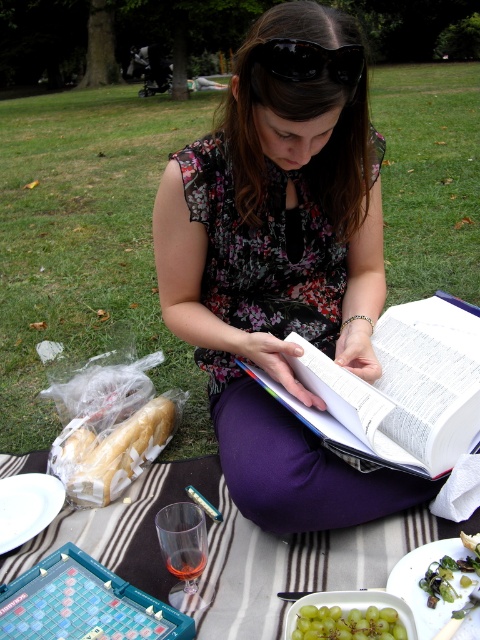
Question: Which of the following is the closest to the observer?

Choices:
 (A) green matte salad at lower right
 (B) green translucent grapes at lower center
 (C) black plastic goggles at center

Answer: (B)

Question: Estimate the real-world distances between objects in this image. Which object is farther from the white paper book at center?

Choices:
 (A) black plastic goggles at center
 (B) green matte salad at lower right

Answer: (A)

Question: Does white paper book at center have a lesser width compared to green matte salad at lower right?

Choices:
 (A) no
 (B) yes

Answer: (A)

Question: Can you confirm if white paper book at center is positioned above green matte salad at lower right?

Choices:
 (A) no
 (B) yes

Answer: (B)

Question: Which object is closer to the camera taking this photo?

Choices:
 (A) green grass at lower left
 (B) green leafy vegetables at lower right
 (C) green matte salad at lower right
 (D) green translucent grapes at lower center

Answer: (D)

Question: Does white paper book at center appear on the left side of green translucent grapes at lower center?

Choices:
 (A) yes
 (B) no

Answer: (B)